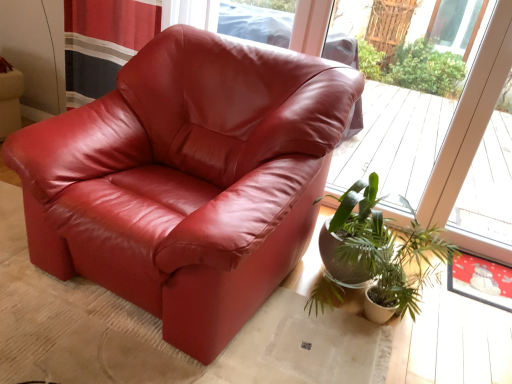
Where is `matte leather armchair at center`? matte leather armchair at center is located at coordinates (187, 179).

Describe the element at coordinates (444, 147) in the screenshot. I see `transparent glass window at upper center` at that location.

Identify the location of green leafy plant at lower right. The image size is (512, 384). (386, 248).

The width and height of the screenshot is (512, 384). In order to click on houseplant directly beneath the matte leather armchair at center (from a real-world perspective) in this screenshot , I will do `click(386, 248)`.

Which is more to the left, matte leather armchair at center or green leafy plant at lower right?

From the viewer's perspective, matte leather armchair at center appears more on the left side.

Is matte leather armchair at center positioned beyond the bounds of green leafy plant at lower right?

Indeed, matte leather armchair at center is completely outside green leafy plant at lower right.

Considering the sizes of transparent glass window at upper center and matte leather armchair at center in the image, is transparent glass window at upper center wider or thinner than matte leather armchair at center?

Considering their sizes, transparent glass window at upper center looks slimmer than matte leather armchair at center.

Considering the positions of objects transparent glass window at upper center and matte leather armchair at center in the image provided, who is more to the right, transparent glass window at upper center or matte leather armchair at center?

transparent glass window at upper center.

Looking at this image, which is correct: transparent glass window at upper center is inside matte leather armchair at center, or outside of it?

The correct answer is: outside.

From a real-world perspective, is transparent glass window at upper center under green leafy plant at lower right?

No.

Which object is further away from the camera, transparent glass window at upper center or green leafy plant at lower right?

transparent glass window at upper center is further away from the camera.

Are transparent glass window at upper center and green leafy plant at lower right located far from each other?

They are positioned close to each other.

Does transparent glass window at upper center have a greater width compared to green leafy plant at lower right?

No.

Locate an element on the screen. houseplant located behind the matte leather armchair at center is located at coordinates (386, 248).

Considering the relative sizes of green leafy plant at lower right and matte leather armchair at center in the image provided, is green leafy plant at lower right bigger than matte leather armchair at center?

Actually, green leafy plant at lower right might be smaller than matte leather armchair at center.

Between green leafy plant at lower right and matte leather armchair at center, which one has more height?

With more height is matte leather armchair at center.

Could you tell me if green leafy plant at lower right is facing matte leather armchair at center?

No, green leafy plant at lower right is not oriented towards matte leather armchair at center.

Between green leafy plant at lower right and transparent glass window at upper center, which one has less height?

green leafy plant at lower right is shorter.

Does green leafy plant at lower right have a greater width compared to transparent glass window at upper center?

Yes.

From the image's perspective, is green leafy plant at lower right beneath transparent glass window at upper center?

Indeed, from the image's perspective, green leafy plant at lower right is shown beneath transparent glass window at upper center.

Is green leafy plant at lower right touching transparent glass window at upper center?

They are not placed beside each other.

How many degrees apart are the facing directions of matte leather armchair at center and transparent glass window at upper center?

The angle between the facing direction of matte leather armchair at center and the facing direction of transparent glass window at upper center is 6.19 degrees.

From a real-world perspective, is matte leather armchair at center above or below transparent glass window at upper center?

Clearly, from a real-world perspective, matte leather armchair at center is below transparent glass window at upper center.

From the picture: Is matte leather armchair at center directly adjacent to transparent glass window at upper center?

No, matte leather armchair at center is not next to transparent glass window at upper center.

Identify the location of houseplant beneath the matte leather armchair at center (from a real-world perspective). (386, 248).

You are a GUI agent. You are given a task and a screenshot of the screen. Output one action in this format:
    pyautogui.click(x=<x>, y=<y>)
    Task: Click on the chair on the left of transparent glass window at upper center
    The image size is (512, 384).
    Given the screenshot: What is the action you would take?
    pyautogui.click(x=187, y=179)

When comparing their distances from matte leather armchair at center, does green leafy plant at lower right or transparent glass window at upper center seem further?

Among the two, transparent glass window at upper center is located further to matte leather armchair at center.

From the image, which object appears to be farther from green leafy plant at lower right, transparent glass window at upper center or matte leather armchair at center?

Among the two, transparent glass window at upper center is located further to green leafy plant at lower right.

Consider the image. Estimate the real-world distances between objects in this image. Which object is closer to transparent glass window at upper center, green leafy plant at lower right or matte leather armchair at center?

Among the two, green leafy plant at lower right is located nearer to transparent glass window at upper center.

Estimate the real-world distances between objects in this image. Which object is further from green leafy plant at lower right, matte leather armchair at center or transparent glass window at upper center?

Among the two, transparent glass window at upper center is located further to green leafy plant at lower right.

Based on the photo, looking at the image, which one is located further to matte leather armchair at center, transparent glass window at upper center or green leafy plant at lower right?

transparent glass window at upper center is further to matte leather armchair at center.

Considering their positions, is matte leather armchair at center positioned further to transparent glass window at upper center than green leafy plant at lower right?

The object further to transparent glass window at upper center is matte leather armchair at center.

Image resolution: width=512 pixels, height=384 pixels. In order to click on houseplant positioned between matte leather armchair at center and transparent glass window at upper center from near to far in this screenshot , I will do `click(386, 248)`.